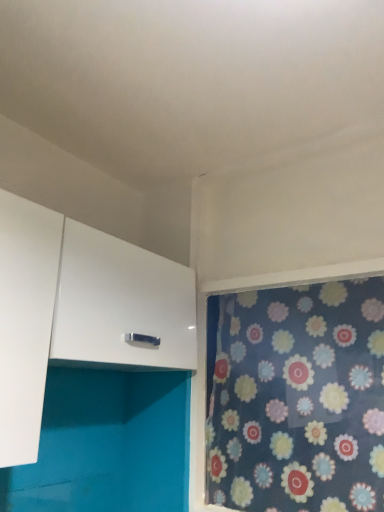
The height and width of the screenshot is (512, 384). What do you see at coordinates (121, 304) in the screenshot? I see `white glossy cabinet at upper left` at bounding box center [121, 304].

Find the location of `white glossy cabinet at upper left`. white glossy cabinet at upper left is located at coordinates (121, 304).

What do you see at coordinates (297, 398) in the screenshot?
I see `floral fabric curtain at right` at bounding box center [297, 398].

This screenshot has height=512, width=384. In order to click on floral fabric curtain at right in this screenshot , I will do `click(297, 398)`.

At what (x,y) coordinates should I click in order to perform the action: click on white glossy cabinet at upper left. Please return your answer as a coordinate pair (x, y). This screenshot has height=512, width=384. Looking at the image, I should click on (121, 304).

Between floral fabric curtain at right and white glossy cabinet at upper left, which one appears on the left side from the viewer's perspective?

white glossy cabinet at upper left is more to the left.

Which object is closer to the camera taking this photo, floral fabric curtain at right or white glossy cabinet at upper left?

white glossy cabinet at upper left is more forward.

Is point (234, 443) less distant than point (132, 320)?

No.

From the image's perspective, is floral fabric curtain at right over white glossy cabinet at upper left?

No.

From a real-world perspective, is floral fabric curtain at right physically above white glossy cabinet at upper left?

Answer: No, from a real-world perspective, floral fabric curtain at right is not on top of white glossy cabinet at upper left.

Considering the sizes of floral fabric curtain at right and white glossy cabinet at upper left in the image, is floral fabric curtain at right wider or thinner than white glossy cabinet at upper left?

Considering their sizes, floral fabric curtain at right looks slimmer than white glossy cabinet at upper left.

Who is taller, floral fabric curtain at right or white glossy cabinet at upper left?

Standing taller between the two is floral fabric curtain at right.

Can you confirm if floral fabric curtain at right is smaller than white glossy cabinet at upper left?

Yes.

Could white glossy cabinet at upper left be considered to be inside floral fabric curtain at right?

No, white glossy cabinet at upper left is not inside floral fabric curtain at right.

Are floral fabric curtain at right and white glossy cabinet at upper left making contact?

No, floral fabric curtain at right is not beside white glossy cabinet at upper left.

Is floral fabric curtain at right oriented towards white glossy cabinet at upper left?

Yes.

What's the angular difference between floral fabric curtain at right and white glossy cabinet at upper left's facing directions?

90.8 degrees separate the facing orientations of floral fabric curtain at right and white glossy cabinet at upper left.

Where is `cabinetry that is in front of the floral fabric curtain at right`? cabinetry that is in front of the floral fabric curtain at right is located at coordinates (121, 304).

Which is more to the left, white glossy cabinet at upper left or floral fabric curtain at right?

white glossy cabinet at upper left is more to the left.

Considering their positions, is white glossy cabinet at upper left located in front of or behind floral fabric curtain at right?

white glossy cabinet at upper left is in front of floral fabric curtain at right.

Does point (87, 352) come in front of point (370, 405)?

That is True.

From the image's perspective, between white glossy cabinet at upper left and floral fabric curtain at right, who is located below?

floral fabric curtain at right.

From a real-world perspective, is white glossy cabinet at upper left over floral fabric curtain at right?

Indeed, from a real-world perspective, white glossy cabinet at upper left stands above floral fabric curtain at right.

In terms of width, does white glossy cabinet at upper left look wider or thinner when compared to floral fabric curtain at right?

Considering their sizes, white glossy cabinet at upper left looks broader than floral fabric curtain at right.

Consider the image. Considering the sizes of objects white glossy cabinet at upper left and floral fabric curtain at right in the image provided, who is shorter, white glossy cabinet at upper left or floral fabric curtain at right?

white glossy cabinet at upper left.

Can you confirm if white glossy cabinet at upper left is smaller than floral fabric curtain at right?

No, white glossy cabinet at upper left is not smaller than floral fabric curtain at right.

In the scene shown: Is floral fabric curtain at right surrounded by white glossy cabinet at upper left?

No, floral fabric curtain at right is not a part of white glossy cabinet at upper left.

Are white glossy cabinet at upper left and floral fabric curtain at right located far from each other?

Actually, white glossy cabinet at upper left and floral fabric curtain at right are a little close together.

Consider the image. Could you tell me if white glossy cabinet at upper left is facing floral fabric curtain at right?

Yes, white glossy cabinet at upper left is facing floral fabric curtain at right.

How many degrees apart are the facing directions of white glossy cabinet at upper left and floral fabric curtain at right?

white glossy cabinet at upper left and floral fabric curtain at right are facing 90.8 degrees away from each other.

What are the coordinates of `curtain that is behind the white glossy cabinet at upper left` in the screenshot? It's located at (297, 398).

Identify the location of curtain behind the white glossy cabinet at upper left. 297,398.

This screenshot has height=512, width=384. In order to click on cabinetry that is on the left side of floral fabric curtain at right in this screenshot , I will do `click(121, 304)`.